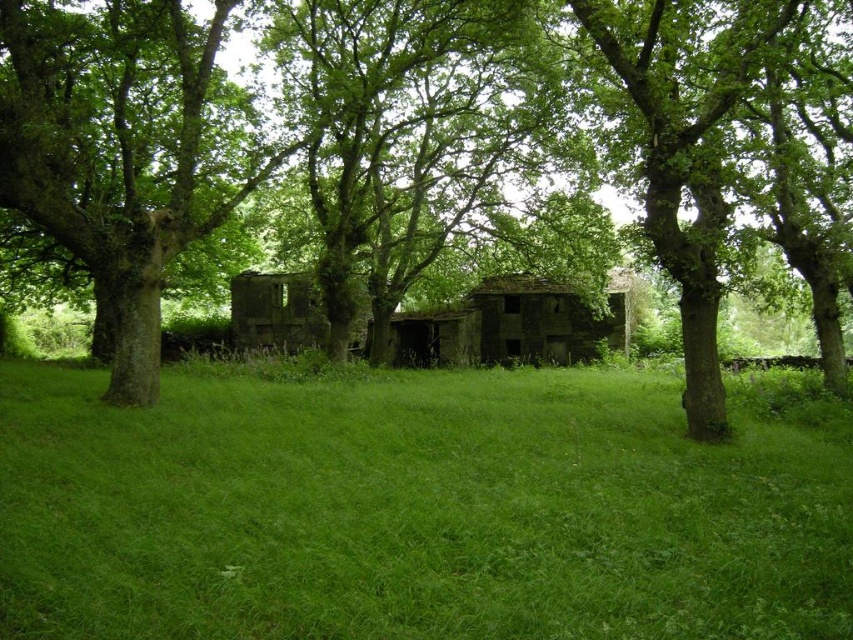
You are a hiker who wants to take a shortcut through the green grassy field at center and the green rough bark tree at left. Which path would be more obstructed by vegetation?

The green grassy field at center is positioned under green rough bark tree at left, so the path under the green rough bark tree at left would be more obstructed by vegetation due to the tree possibly having branches or lower growth.

You are standing at the edge of the scene and want to reach the green grassy field at center. Based on the coordinates provided, in which direction should you move relative to your current position?

The green grassy field at center is located at coordinates point (x=412, y=512), which means it is positioned to the right and slightly forward from your current position at the edge. You should move towards the right and forward to reach it.

In the scene shown: You are a gardener who needs to plant a new tree sapling that requires at least 2 meters of space between it and any existing trees. You see the green leafy tree at center and the green rough bark tree at left. Can you plant the sapling between them?

The distance between the green leafy tree at center and the green rough bark tree at left is 2.18 meters, which is more than the required 2 meters. Therefore, you can plant the sapling between them.